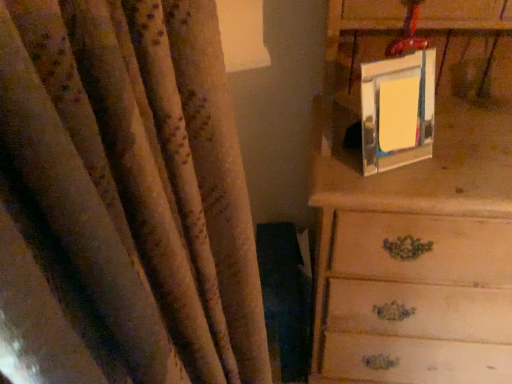
Question: Is wooden chest of drawers at upper right positioned beyond the bounds of metallic reflective picture frame at upper right?

Choices:
 (A) no
 (B) yes

Answer: (B)

Question: Is wooden chest of drawers at upper right to the left of metallic reflective picture frame at upper right from the viewer's perspective?

Choices:
 (A) yes
 (B) no

Answer: (B)

Question: Is wooden chest of drawers at upper right directly adjacent to metallic reflective picture frame at upper right?

Choices:
 (A) yes
 (B) no

Answer: (B)

Question: From a real-world perspective, does wooden chest of drawers at upper right stand above metallic reflective picture frame at upper right?

Choices:
 (A) no
 (B) yes

Answer: (A)

Question: Can you confirm if wooden chest of drawers at upper right is smaller than metallic reflective picture frame at upper right?

Choices:
 (A) yes
 (B) no

Answer: (B)

Question: Is wooden chest of drawers at upper right bigger than metallic reflective picture frame at upper right?

Choices:
 (A) no
 (B) yes

Answer: (B)

Question: Is metallic reflective picture frame at upper right next to wooden chest of drawers at upper right and touching it?

Choices:
 (A) no
 (B) yes

Answer: (A)

Question: From the image's perspective, is metallic reflective picture frame at upper right on top of wooden chest of drawers at upper right?

Choices:
 (A) no
 (B) yes

Answer: (B)

Question: Could you tell me if metallic reflective picture frame at upper right is facing wooden chest of drawers at upper right?

Choices:
 (A) no
 (B) yes

Answer: (B)

Question: Is metallic reflective picture frame at upper right located outside wooden chest of drawers at upper right?

Choices:
 (A) no
 (B) yes

Answer: (A)

Question: From a real-world perspective, is metallic reflective picture frame at upper right positioned under wooden chest of drawers at upper right based on gravity?

Choices:
 (A) no
 (B) yes

Answer: (A)

Question: Is metallic reflective picture frame at upper right turned away from wooden chest of drawers at upper right?

Choices:
 (A) no
 (B) yes

Answer: (B)

Question: From a real-world perspective, relative to metallic reflective picture frame at upper right, is wooden chest of drawers at upper right vertically above or below?

Choices:
 (A) above
 (B) below

Answer: (B)